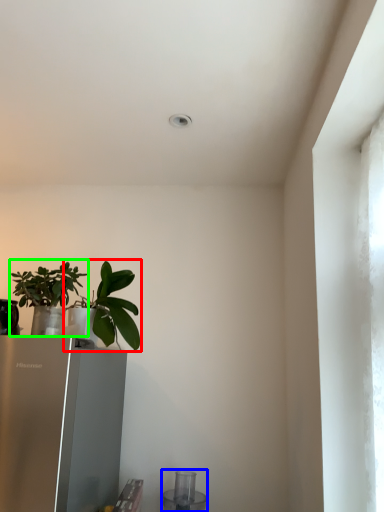
Question: Considering the real-world distances, which object is farthest from houseplant (highlighted by a red box)? appliance (highlighted by a blue box) or houseplant (highlighted by a green box)?

Choices:
 (A) appliance
 (B) houseplant

Answer: (A)